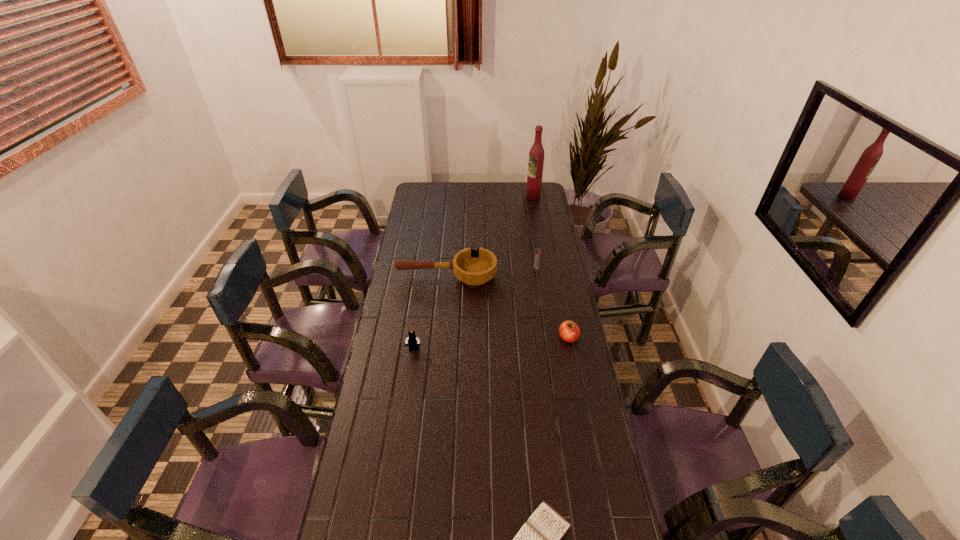
The height and width of the screenshot is (540, 960). Find the location of `vacant region located 0.120m on the front-facing side of the fifth farthest object`. vacant region located 0.120m on the front-facing side of the fifth farthest object is located at coordinates (410, 380).

Locate an element on the screen. This screenshot has height=540, width=960. vacant area situated 0.390m on the front of the apple is located at coordinates (588, 440).

What are the coordinates of `object at the far edge` in the screenshot? It's located at pyautogui.click(x=536, y=155).

This screenshot has width=960, height=540. I want to click on Lego situated at the left edge, so click(412, 341).

Where is `saucepan that is at the left edge`? This screenshot has width=960, height=540. saucepan that is at the left edge is located at coordinates (474, 267).

At what (x,y) coordinates should I click in order to perform the action: click on liquor positioned at the right edge. Please return your answer as a coordinate pair (x, y). This screenshot has height=540, width=960. Looking at the image, I should click on (536, 155).

Locate an element on the screen. igniter that is at the right edge is located at coordinates (537, 252).

Where is `apple located at the right edge`? This screenshot has height=540, width=960. apple located at the right edge is located at coordinates (569, 331).

Locate an element on the screen. The width and height of the screenshot is (960, 540). object situated at the far right corner is located at coordinates (536, 155).

In the image, there is a desktop. At what (x,y) coordinates should I click in order to perform the action: click on free space at the far edge. Please return your answer as a coordinate pair (x, y). The height and width of the screenshot is (540, 960). Looking at the image, I should click on (450, 199).